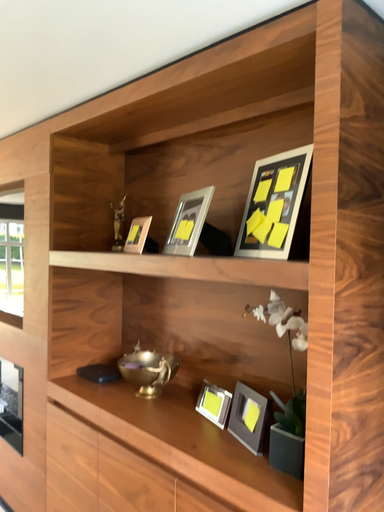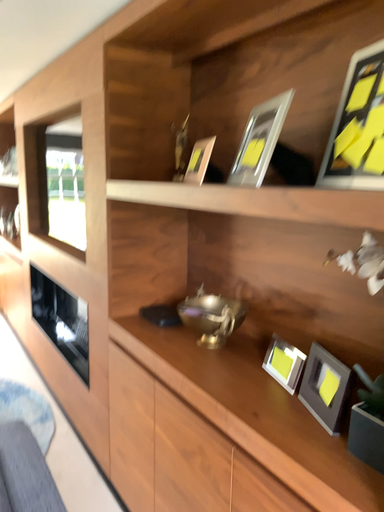
Question: Which way did the camera rotate in the video?

Choices:
 (A) rotated left
 (B) rotated right

Answer: (A)